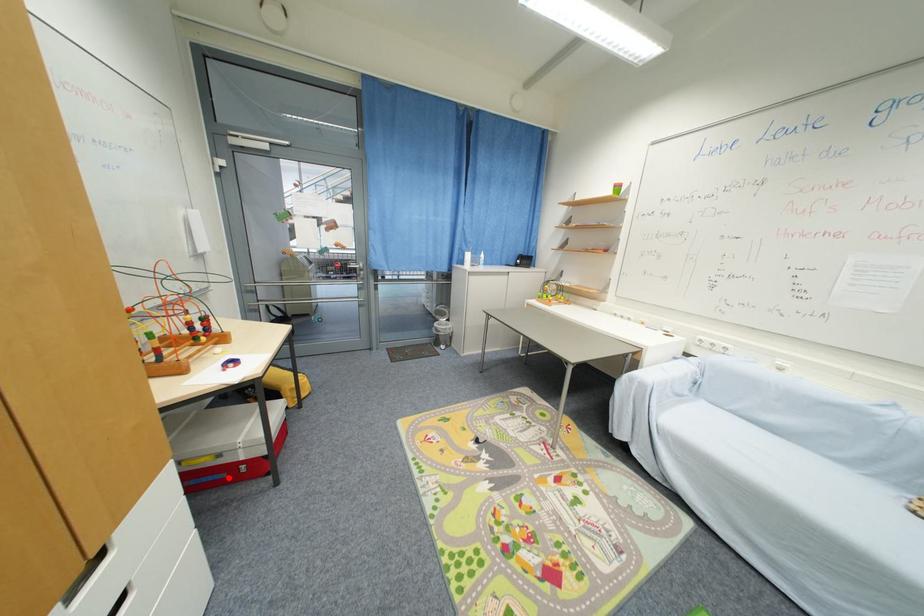
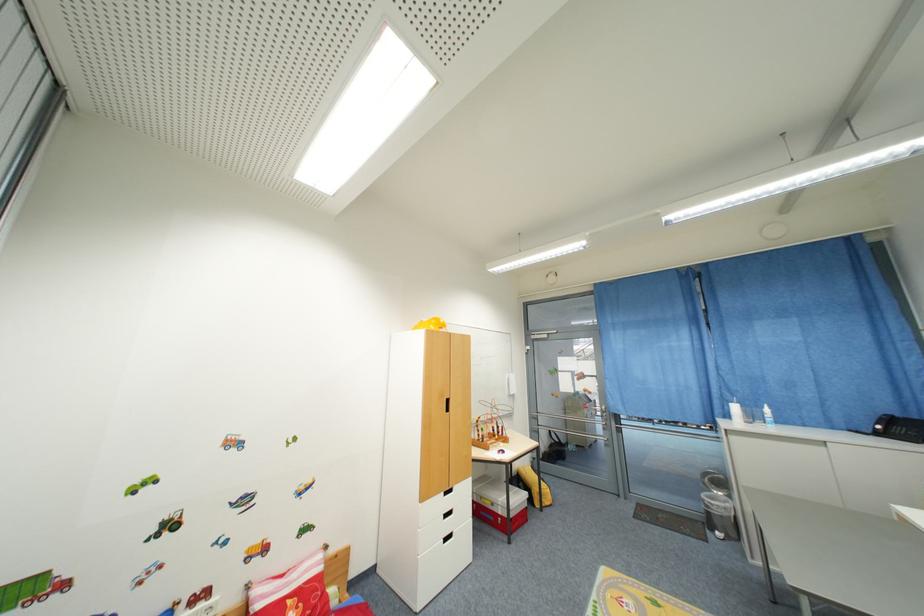
In the second image, find the point that corresponds to the highlighted location in the first image.

(497, 521)